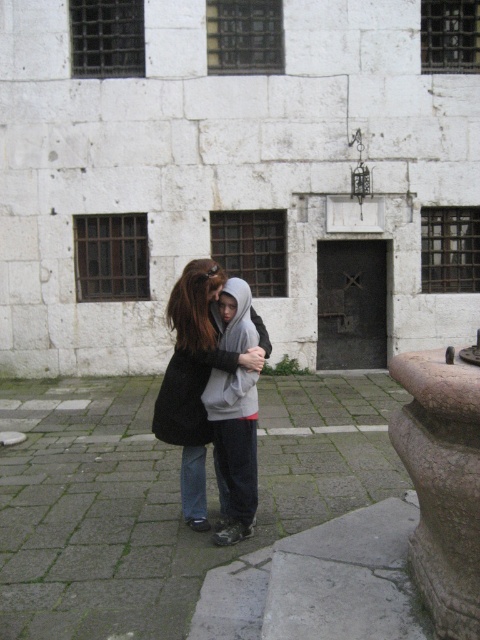
Question: Does brown stone pillar at lower right appear on the left side of dark gray hoodie at center?

Choices:
 (A) no
 (B) yes

Answer: (A)

Question: Among these objects, which one is farthest from the camera?

Choices:
 (A) brown stone pillar at lower right
 (B) dark gray hoodie at center

Answer: (B)

Question: Which point is closer to the camera?

Choices:
 (A) brown stone pillar at lower right
 (B) dark gray hoodie at center

Answer: (A)

Question: Can you confirm if brown stone pillar at lower right is positioned to the left of dark gray hoodie at center?

Choices:
 (A) no
 (B) yes

Answer: (A)

Question: Which point is closer to the camera?

Choices:
 (A) brown stone pillar at lower right
 (B) dark gray hoodie at center

Answer: (A)

Question: Observing the image, what is the correct spatial positioning of brown stone pillar at lower right in reference to dark gray hoodie at center?

Choices:
 (A) right
 (B) left

Answer: (A)